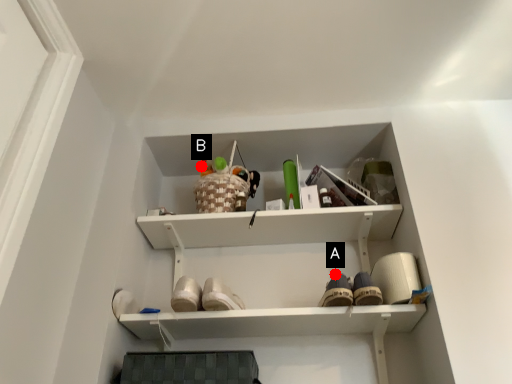
Question: Two points are circled on the image, labeled by A and B beside each circle. Among these points, which one is farthest from the camera?

Choices:
 (A) A is further
 (B) B is further

Answer: (B)